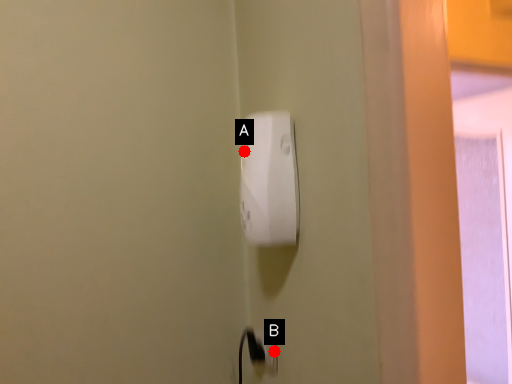
Question: Two points are circled on the image, labeled by A and B beside each circle. Which point is closer to the camera?

Choices:
 (A) A is closer
 (B) B is closer

Answer: (A)